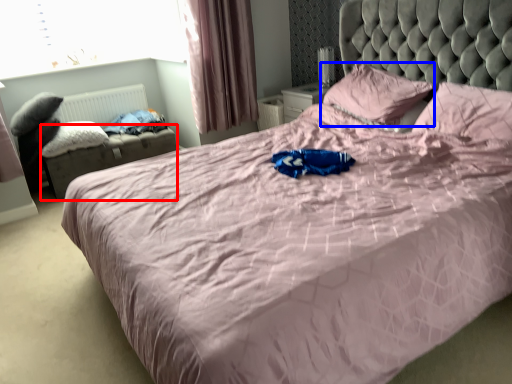
Question: Which object is further to the camera taking this photo, footrest (highlighted by a red box) or pillow (highlighted by a blue box)?

Choices:
 (A) footrest
 (B) pillow

Answer: (A)